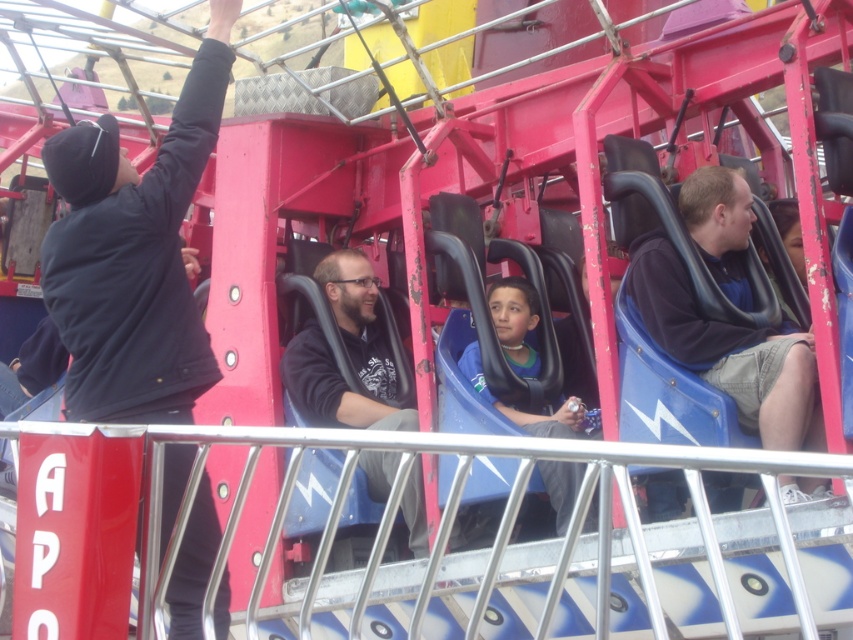
Question: Is black matte jacket at upper left positioned behind blue matte seat at center?

Choices:
 (A) no
 (B) yes

Answer: (A)

Question: Estimate the real-world distances between objects in this image. Which object is closer to the matte black jacket at center?

Choices:
 (A) black matte jacket at upper left
 (B) matte blue seat at center

Answer: (A)

Question: Which is farther from the matte blue seat at center?

Choices:
 (A) blue matte seat at center
 (B) black matte jacket at upper left
 (C) matte black jacket at center

Answer: (B)

Question: Which of the following is the farthest from the observer?

Choices:
 (A) (218, 36)
 (B) (564, 419)
 (C) (375, 289)
 (D) (790, 403)

Answer: (C)

Question: Is matte black jacket at center positioned before blue matte seat at center?

Choices:
 (A) no
 (B) yes

Answer: (A)

Question: In this image, where is black matte jacket at upper left located relative to blue matte seat at center?

Choices:
 (A) left
 (B) right

Answer: (A)